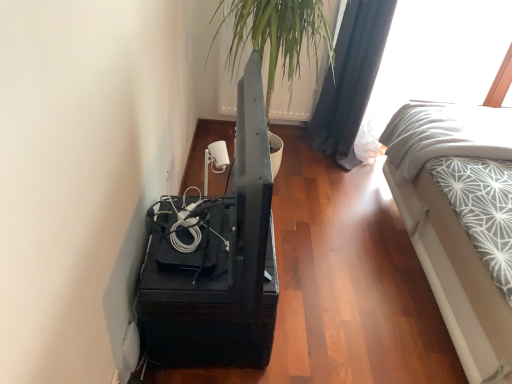
Measure the distance between point (406, 21) and camera.

Point (406, 21) and camera are 2.11 meters apart from each other.

You are a GUI agent. You are given a task and a screenshot of the screen. Output one action in this format:
    pyautogui.click(x=<x>, y=<y>)
    Task: Click on the white textured fabric at right
    
    Given the screenshot: What is the action you would take?
    pyautogui.click(x=445, y=135)

Find the location of `transparent glass window at upper right`. transparent glass window at upper right is located at coordinates (435, 59).

How different are the orientations of white textured bed at right and white textured fabric at right in degrees?

The angular difference between white textured bed at right and white textured fabric at right is 0.784 degrees.

Is white textured bed at right not inside white textured fabric at right?

Indeed, white textured bed at right is completely outside white textured fabric at right.

Who is bigger, white textured bed at right or white textured fabric at right?

With larger size is white textured bed at right.

Who is taller, white textured bed at right or white textured fabric at right?

white textured bed at right.

How distant is white textured fabric at right from black matte tv stand at lower left?

white textured fabric at right and black matte tv stand at lower left are 3.58 feet apart.

Is black matte tv stand at lower left at the back of white textured fabric at right?

No, white textured fabric at right's orientation is not away from black matte tv stand at lower left.

Consider the image. Is white textured fabric at right beside black matte tv stand at lower left?

white textured fabric at right and black matte tv stand at lower left are not in contact.

What's the angular difference between white textured fabric at right and black matte tv stand at lower left's facing directions?

The facing directions of white textured fabric at right and black matte tv stand at lower left are 177 degrees apart.

How different are the orientations of white textured fabric at right and green leafy plant at upper center in degrees?

There is a 178-degree angle between the facing directions of white textured fabric at right and green leafy plant at upper center.

Is white textured fabric at right outside of green leafy plant at upper center?

Absolutely, white textured fabric at right is external to green leafy plant at upper center.

Is white textured fabric at right not near green leafy plant at upper center?

No, there isn't a large distance between white textured fabric at right and green leafy plant at upper center.

Which of these two, white textured fabric at right or green leafy plant at upper center, is bigger?

Bigger between the two is green leafy plant at upper center.

Looking at this image, is white textured bed at right next to black matte tv stand at lower left?

No.

You are a GUI agent. You are given a task and a screenshot of the screen. Output one action in this format:
    pyautogui.click(x=<x>, y=<y>)
    Task: Click on the furniture below the white textured bed at right (from the image's perspective)
    
    Given the screenshot: What is the action you would take?
    pyautogui.click(x=211, y=288)

Can you confirm if white textured bed at right is taller than black matte tv stand at lower left?

Yes, white textured bed at right is taller than black matte tv stand at lower left.

Considering the sizes of objects white textured bed at right and black matte tv stand at lower left in the image provided, who is bigger, white textured bed at right or black matte tv stand at lower left?

white textured bed at right.

Is point (472, 105) more distant than point (338, 153)?

No, it is not.

From a real-world perspective, is white textured bed at right above or below black fabric curtain at upper right?

white textured bed at right is below black fabric curtain at upper right.

Is white textured bed at right thinner than black fabric curtain at upper right?

No, white textured bed at right is not thinner than black fabric curtain at upper right.

Considering the relative positions of white textured bed at right and black fabric curtain at upper right in the image provided, is white textured bed at right to the left or to the right of black fabric curtain at upper right?

white textured bed at right is positioned on black fabric curtain at upper right's right side.

Which is nearer, (x=146, y=281) or (x=356, y=122)?

Point (x=146, y=281).

Looking at this image, are black matte tv stand at lower left and black fabric curtain at upper right located far from each other?

black matte tv stand at lower left is far away from black fabric curtain at upper right.

From the image's perspective, is black matte tv stand at lower left above black fabric curtain at upper right?

No.

Does black matte tv stand at lower left turn towards black fabric curtain at upper right?

No, black matte tv stand at lower left is not turned towards black fabric curtain at upper right.

Does transparent glass window at upper right appear on the left side of black fabric curtain at upper right?

In fact, transparent glass window at upper right is to the right of black fabric curtain at upper right.

From a real-world perspective, which object stands above the other?

In real-world perspective, transparent glass window at upper right is above.

Considering the points (432, 12) and (316, 118), which point is behind, point (432, 12) or point (316, 118)?

The point (316, 118) is farther.

Who is taller, transparent glass window at upper right or black fabric curtain at upper right?

transparent glass window at upper right is taller.

Image resolution: width=512 pixels, height=384 pixels. Find the location of `bedding to the left of white textured bed at right`. bedding to the left of white textured bed at right is located at coordinates point(445,135).

The width and height of the screenshot is (512, 384). I want to click on furniture below the white textured fabric at right (from a real-world perspective), so click(211, 288).

Considering their positions, is black matte tv stand at lower left positioned closer to white textured fabric at right than white textured bed at right?

The object closer to white textured fabric at right is white textured bed at right.

Which object lies further to the anchor point black fabric curtain at upper right, white textured bed at right or green leafy plant at upper center?

Among the two, white textured bed at right is located further to black fabric curtain at upper right.

Based on their spatial positions, is transparent glass window at upper right or black fabric curtain at upper right closer to white textured fabric at right?

Based on the image, black fabric curtain at upper right appears to be nearer to white textured fabric at right.

Looking at the image, which one is located further to green leafy plant at upper center, white textured bed at right or black matte tv stand at lower left?

Among the two, black matte tv stand at lower left is located further to green leafy plant at upper center.

Looking at the image, which one is located closer to white textured bed at right, white textured fabric at right or transparent glass window at upper right?

white textured fabric at right lies closer to white textured bed at right than the other object.

Based on their spatial positions, is black matte tv stand at lower left or transparent glass window at upper right further from black fabric curtain at upper right?

Based on the image, black matte tv stand at lower left appears to be further to black fabric curtain at upper right.

Which object lies nearer to the anchor point transparent glass window at upper right, black fabric curtain at upper right or white textured fabric at right?

black fabric curtain at upper right.

Based on their spatial positions, is black fabric curtain at upper right or transparent glass window at upper right further from black matte tv stand at lower left?

The object further to black matte tv stand at lower left is transparent glass window at upper right.

Find the location of `houseplant between black matte tv stand at lower left and white textured fabric at right from left to right`. houseplant between black matte tv stand at lower left and white textured fabric at right from left to right is located at coordinates (277, 38).

Locate an element on the screen. The width and height of the screenshot is (512, 384). curtain between transparent glass window at upper right and black matte tv stand at lower left from top to bottom is located at coordinates (351, 79).

Locate an element on the screen. The width and height of the screenshot is (512, 384). bedding located between white textured bed at right and black fabric curtain at upper right in the depth direction is located at coordinates (445, 135).

The height and width of the screenshot is (384, 512). I want to click on bedding between black matte tv stand at lower left and white textured bed at right from left to right, so click(445, 135).